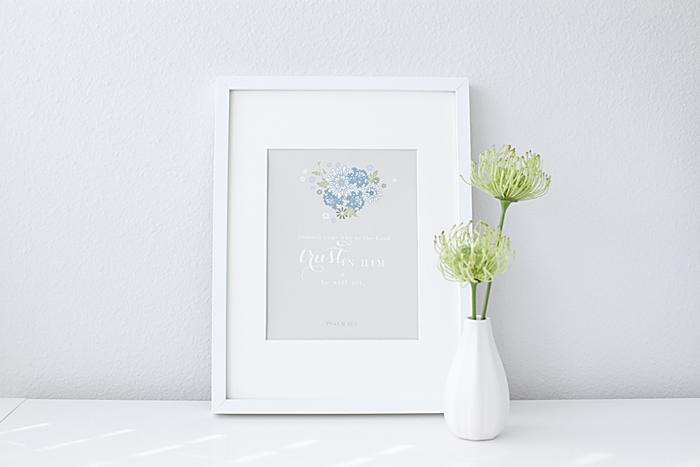
Where is `white vase`? white vase is located at coordinates tap(486, 394).